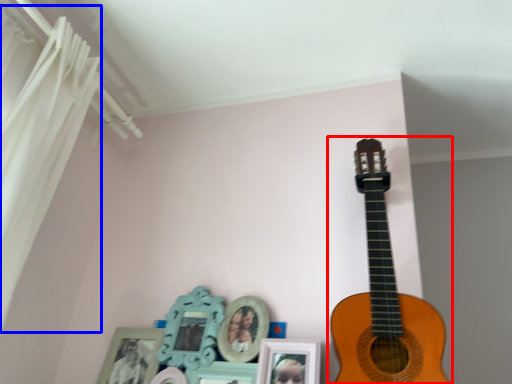
Question: Which object is closer to the camera taking this photo, guitar (highlighted by a red box) or curtain (highlighted by a blue box)?

Choices:
 (A) guitar
 (B) curtain

Answer: (B)